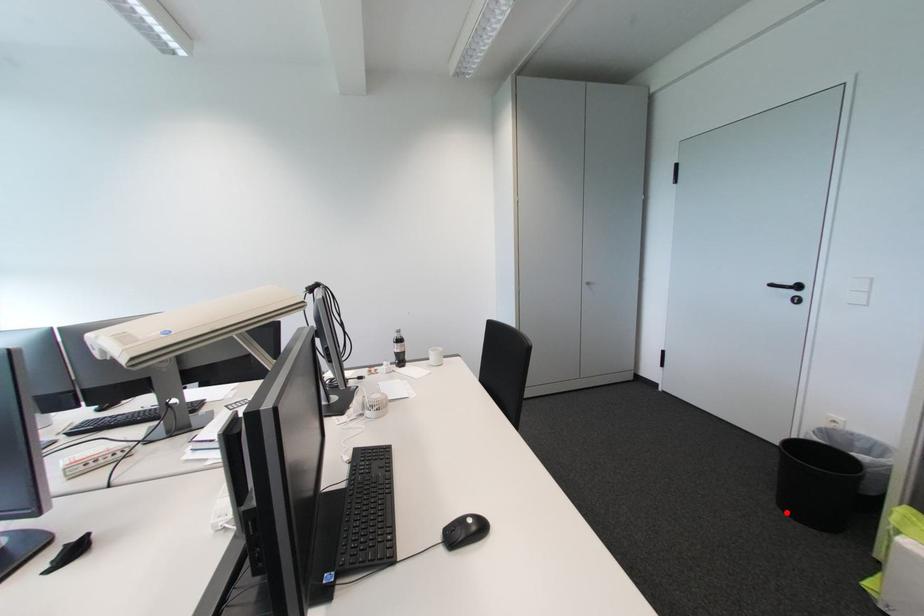
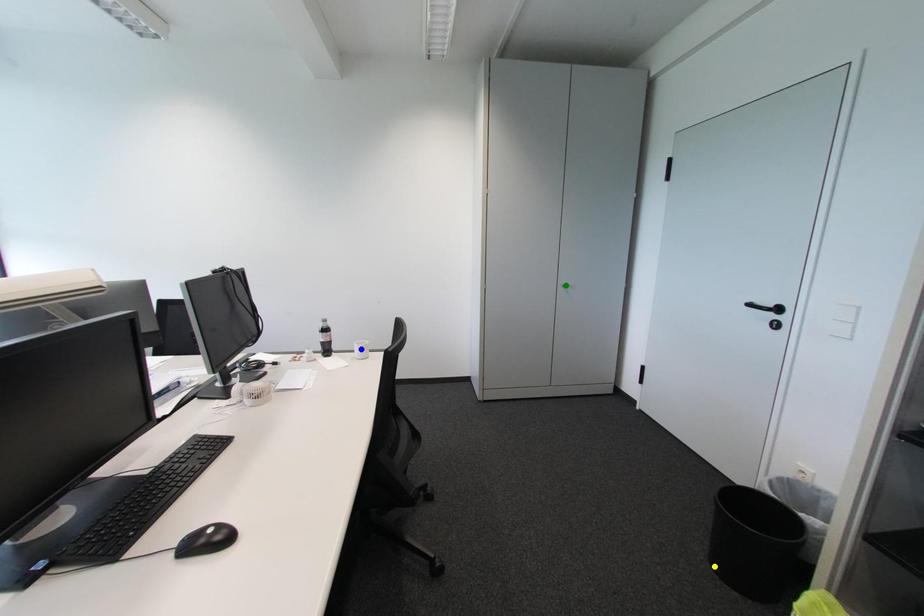
Question: I am providing you with two images of the same scene from different viewpoints. A red point is marked on the first image. You are given multiple points on the second image. In image 2, which mark is for the same physical point as the one in image 1?

Choices:
 (A) yellow point
 (B) green point
 (C) blue point

Answer: (A)